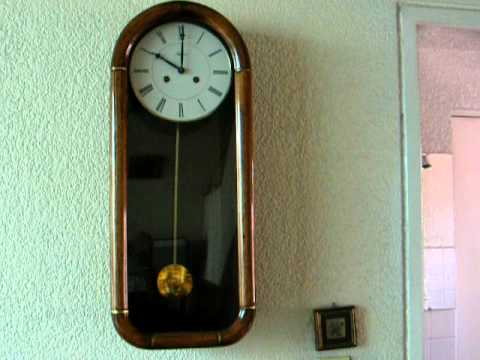
Where is `shadow on wall`? shadow on wall is located at coordinates (286, 149).